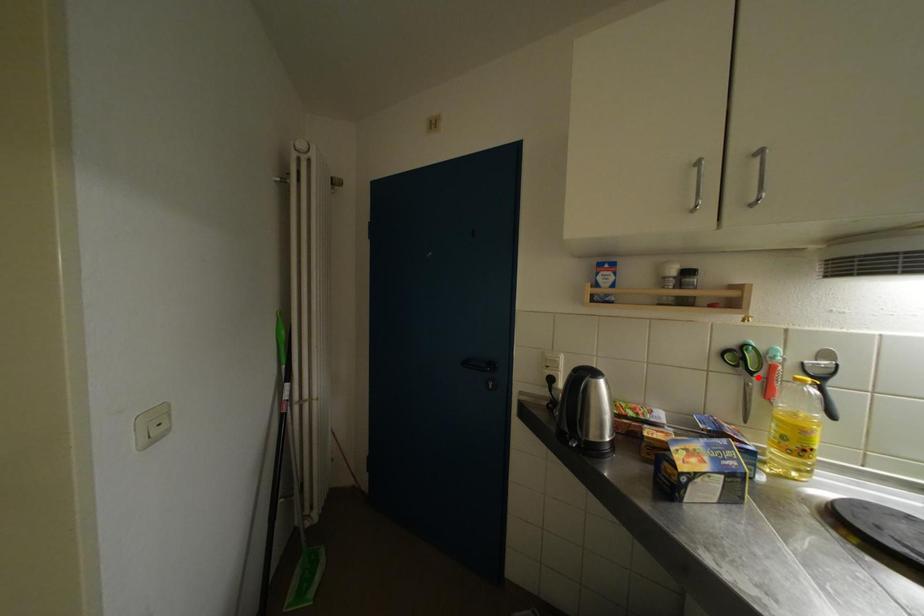
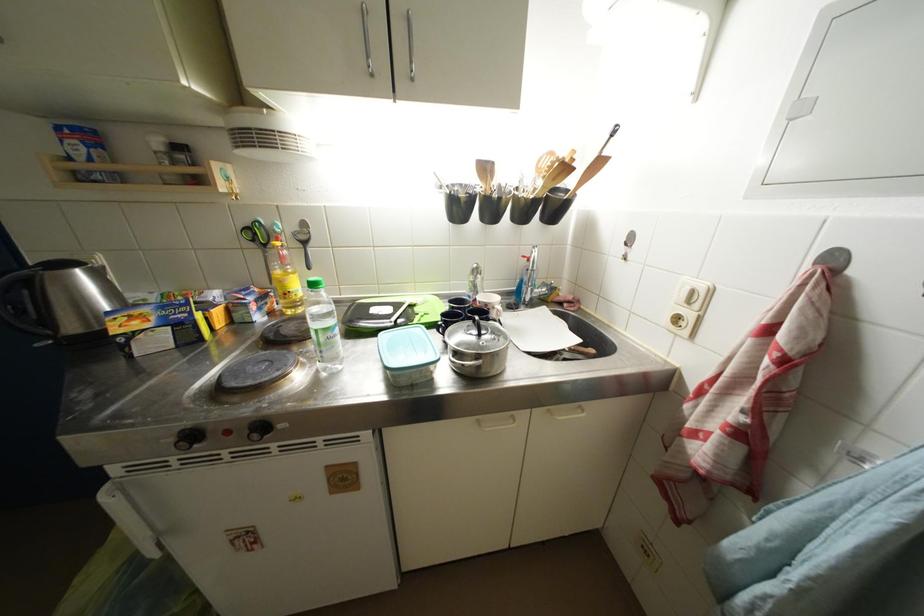
In the second image, find the point that corresponds to the highlighted location in the first image.

(272, 249)